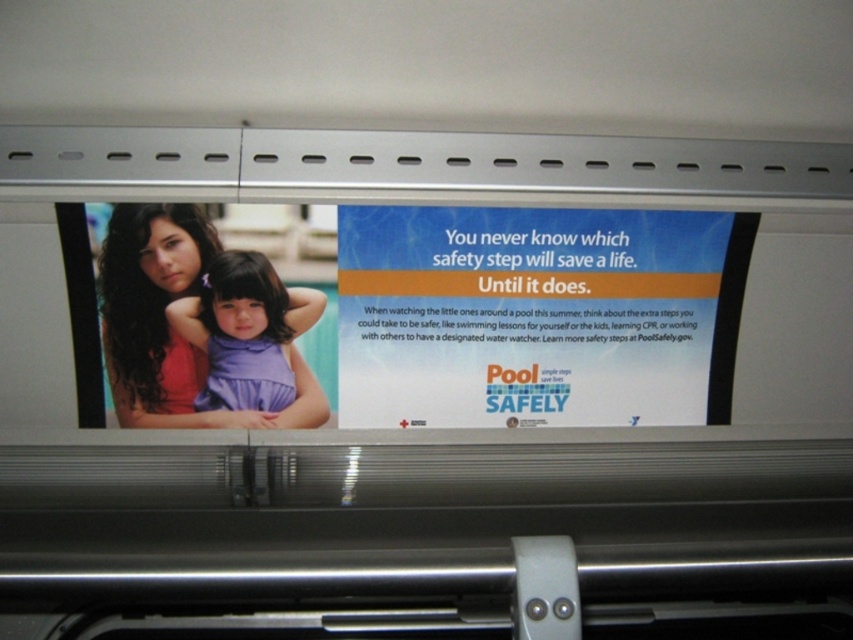
Question: Is white paper at center smaller than purple matte dress at center?

Choices:
 (A) yes
 (B) no

Answer: (B)

Question: Is white paper at center closer to the viewer compared to purple matte dress at center?

Choices:
 (A) yes
 (B) no

Answer: (A)

Question: Is white paper at center thinner than purple matte dress at center?

Choices:
 (A) no
 (B) yes

Answer: (A)

Question: Which point is closer to the camera taking this photo?

Choices:
 (A) pyautogui.click(x=479, y=234)
 (B) pyautogui.click(x=308, y=310)

Answer: (A)

Question: Which object appears closest to the camera in this image?

Choices:
 (A) purple matte dress at center
 (B) white paper at center

Answer: (B)

Question: Among these objects, which one is nearest to the camera?

Choices:
 (A) purple matte dress at center
 (B) white paper at center

Answer: (B)